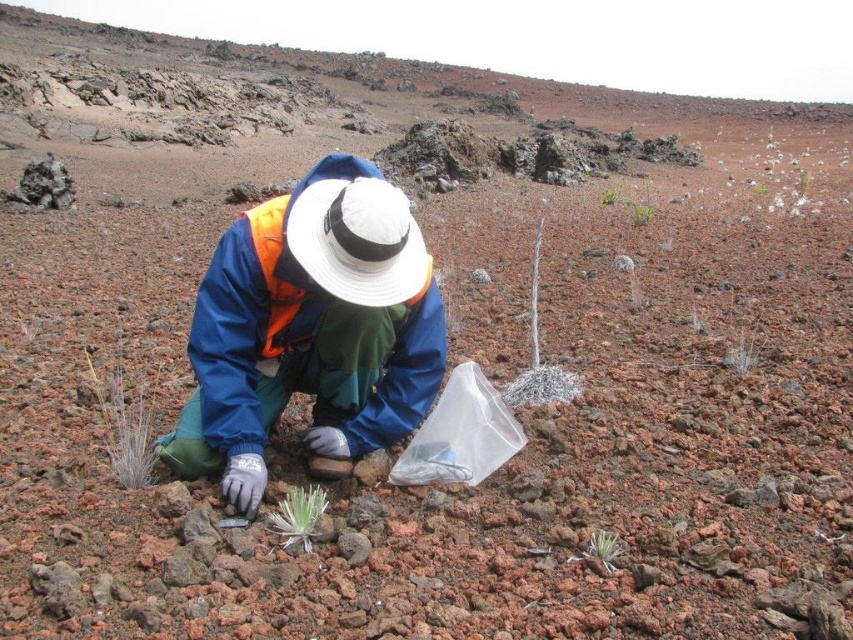
Question: Can you confirm if silvery grass at lower left is positioned to the right of green fuzzy plant at center?

Choices:
 (A) no
 (B) yes

Answer: (A)

Question: Which object appears closest to the camera in this image?

Choices:
 (A) dry twig at center
 (B) white fabric hat at center
 (C) green fuzzy plant at lower center
 (D) green leafy plant at upper right

Answer: (C)

Question: In this image, where is blue fabric jacket at center located relative to green fuzzy plant at lower center?

Choices:
 (A) below
 (B) above

Answer: (B)

Question: In this image, where is green fuzzy plant at center located relative to green fuzzy plant at lower center?

Choices:
 (A) right
 (B) left

Answer: (B)

Question: Which is farther from the blue fabric jacket at center?

Choices:
 (A) green fuzzy plant at lower center
 (B) green fuzzy plant at center
 (C) silvery grass at lower left
 (D) white fabric hat at center

Answer: (A)

Question: Which object is farther from the camera taking this photo?

Choices:
 (A) green fuzzy plant at center
 (B) green leafy plant at upper center
 (C) dry twig at center
 (D) silvery metallic plant at center

Answer: (B)